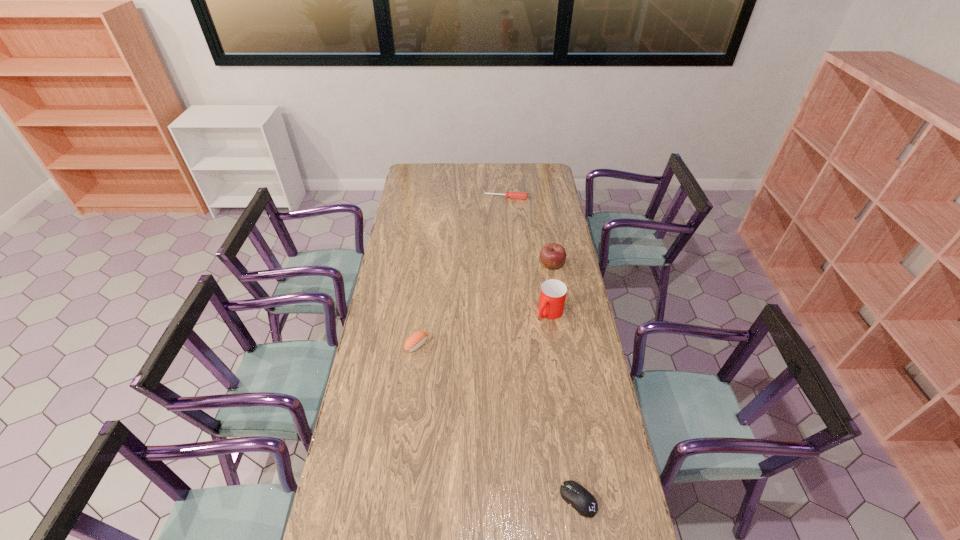
Locate an element on the screen. This screenshot has height=540, width=960. vacant space located 0.260m on the side of the tallest object with the handle is located at coordinates (506, 361).

Identify the location of vacant area situated 0.110m on the side of the tallest object with the handle. (528, 337).

Where is `blank space located 0.390m on the side of the tallest object with the handle`? The image size is (960, 540). blank space located 0.390m on the side of the tallest object with the handle is located at coordinates point(486,382).

You are a GUI agent. You are given a task and a screenshot of the screen. Output one action in this format:
    pyautogui.click(x=<x>, y=<y>)
    Task: Click on the vacant space located 0.340m on the side of the apple with the unique marking
    The image size is (960, 540).
    Given the screenshot: What is the action you would take?
    pyautogui.click(x=515, y=320)

Find the location of `vacant point located 0.060m on the side of the apple with the unique marking`. vacant point located 0.060m on the side of the apple with the unique marking is located at coordinates (541, 280).

Find the location of a particular element. Image resolution: width=960 pixels, height=540 pixels. vacant point located on the side of the apple with the unique marking is located at coordinates (523, 306).

At what (x,y) coordinates should I click in order to perform the action: click on free space located at the blade of the screwdriver. Please return your answer as a coordinate pair (x, y). The height and width of the screenshot is (540, 960). Looking at the image, I should click on (498, 235).

This screenshot has height=540, width=960. In order to click on free space located at the blade of the screwdriver in this screenshot , I will do `click(502, 212)`.

Identify the location of free location located at the blade of the screwdriver. (498, 235).

Image resolution: width=960 pixels, height=540 pixels. I want to click on object located in the near edge section of the desktop, so click(x=574, y=494).